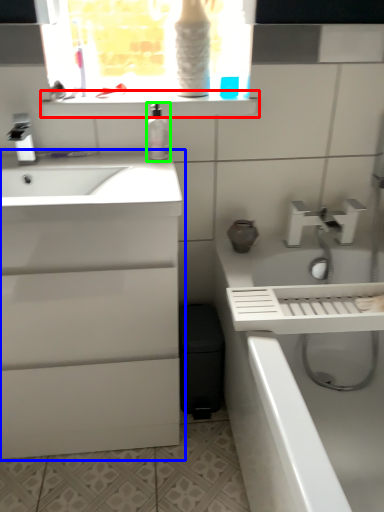
Question: Which object is positioned closest to window sill (highlighted by a red box)? Select from bathroom cabinet (highlighted by a blue box) and soap dispenser (highlighted by a green box).

Choices:
 (A) bathroom cabinet
 (B) soap dispenser

Answer: (B)